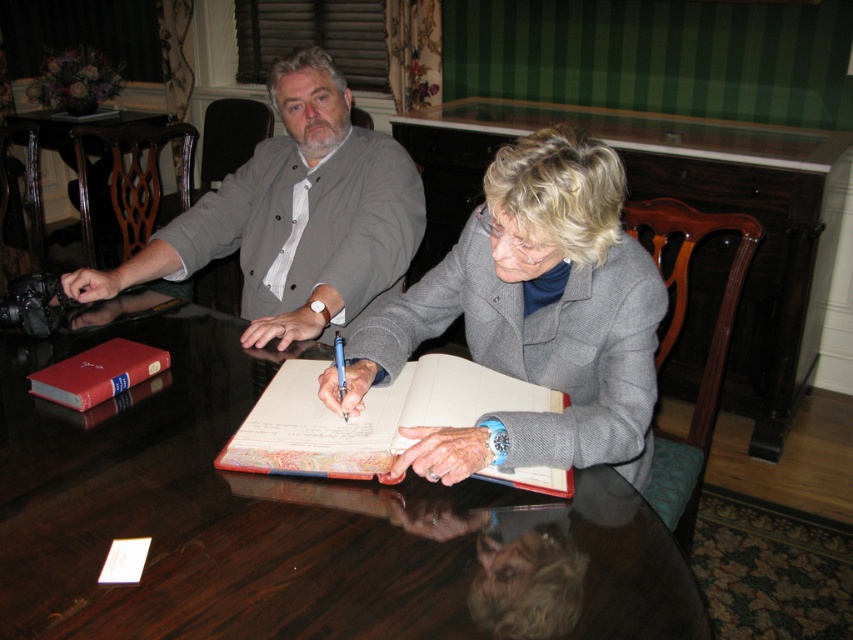
In the scene shown: Can you confirm if gray wool sweater at left is shorter than leather-bound book at center?

No.

Between gray wool sweater at left and leather-bound book at center, which one is positioned lower?

Positioned lower is leather-bound book at center.

This screenshot has height=640, width=853. I want to click on gray wool sweater at left, so click(294, 216).

Is point (512, 449) more distant than point (103, 394)?

No.

How distant is gray woolen jacket at center from red leather book at lower left?

A distance of 24.70 inches exists between gray woolen jacket at center and red leather book at lower left.

Identify the location of gray woolen jacket at center. The width and height of the screenshot is (853, 640). (532, 317).

Does point (38, 628) come in front of point (370, 403)?

Yes, point (38, 628) is in front of point (370, 403).

Find the location of `glossy wood table at center`. glossy wood table at center is located at coordinates (294, 524).